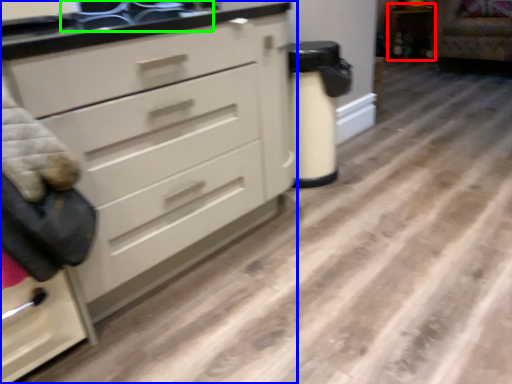
Question: Which object is positioned closest to cabinetry (highlighted by a red box)? Select from chest of drawers (highlighted by a blue box) and sink (highlighted by a green box).

Choices:
 (A) chest of drawers
 (B) sink

Answer: (B)